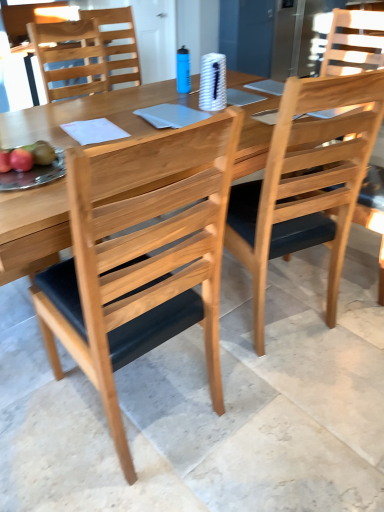
I want to click on vacant area situated below natural wood chair at center, which is the 1th chair from front to back (from a real-world perspective), so click(x=143, y=399).